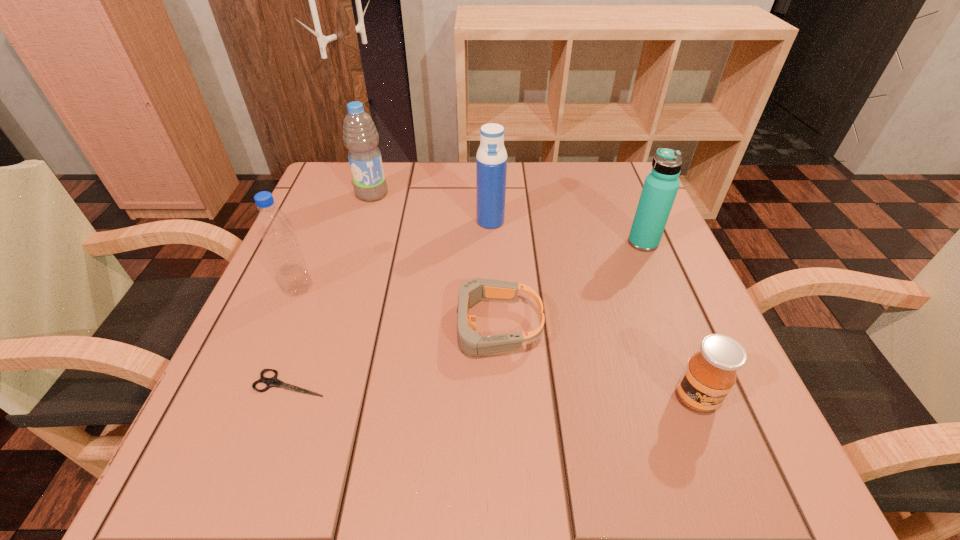
At what (x,y) coordinates should I click in order to perform the action: click on the fourth closest water bottle relative to the goggles. Please return your answer as a coordinate pair (x, y). Image resolution: width=960 pixels, height=540 pixels. Looking at the image, I should click on (361, 138).

The width and height of the screenshot is (960, 540). Identify the location of the second closest water bottle to the goggles. (660, 188).

Image resolution: width=960 pixels, height=540 pixels. I want to click on free location that satisfies the following two spatial constraints: 1. on the back side of the leftmost water bottle; 2. on the right side of the second nearest water bottle, so click(x=318, y=242).